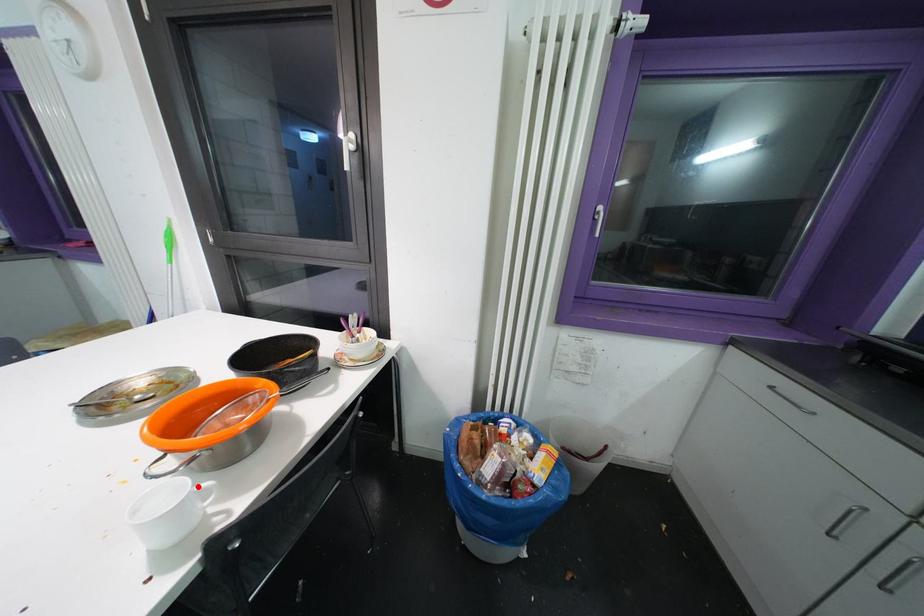
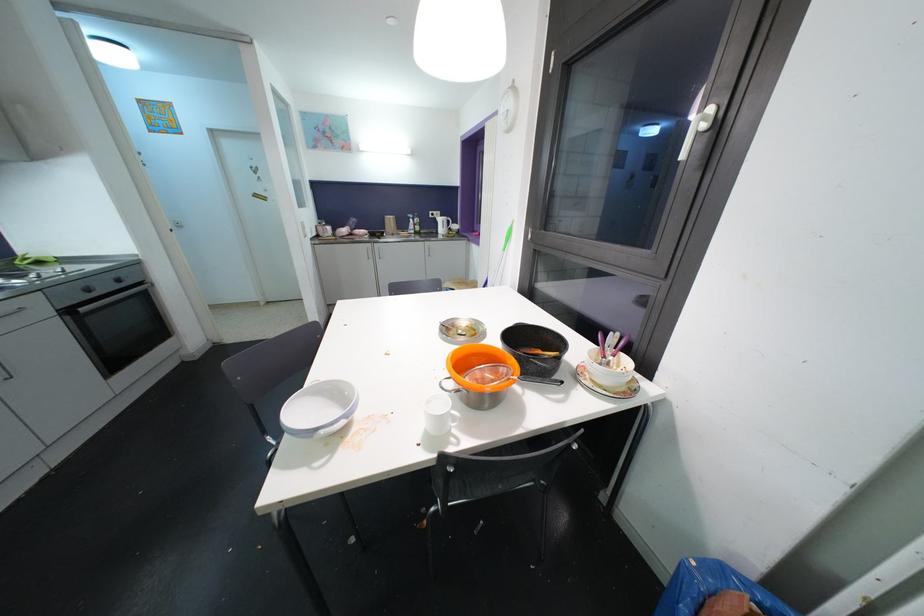
Where in the second image is the point corresponding to the highlighted location from the first image?

(456, 411)